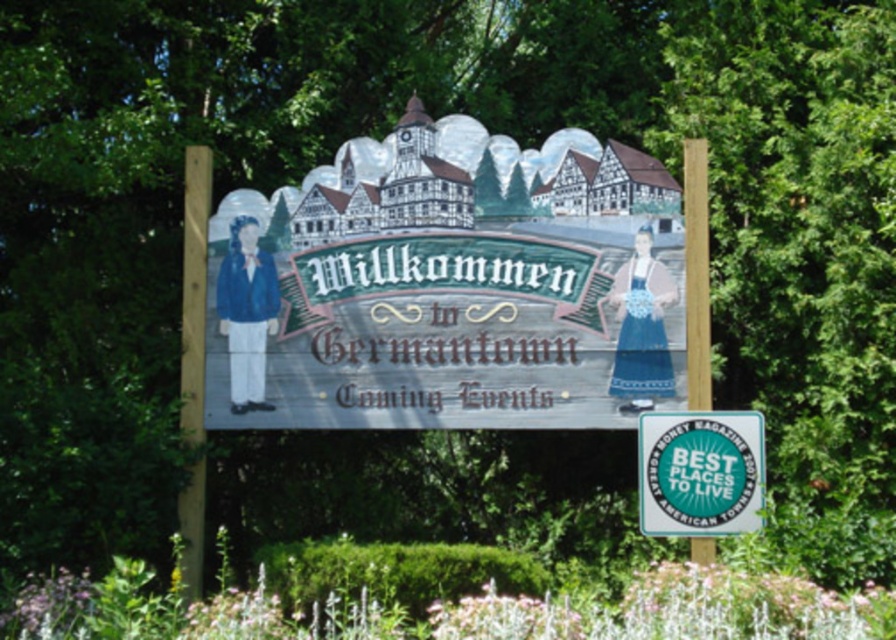
Who is shorter, wooden signboard at center or green glossy sign at center?

Standing shorter between the two is green glossy sign at center.

This screenshot has width=896, height=640. What do you see at coordinates (461, 285) in the screenshot? I see `wooden signboard at center` at bounding box center [461, 285].

Find the location of a particular element. Image resolution: width=896 pixels, height=640 pixels. wooden signboard at center is located at coordinates (461, 285).